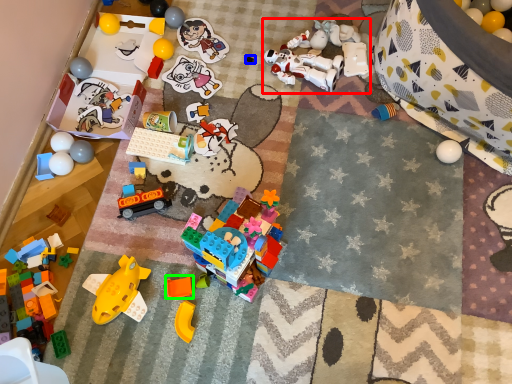
Question: Which object is positioned closest to toy (highlighted by a red box)? Select from toy (highlighted by a blue box) and toy (highlighted by a green box).

Choices:
 (A) toy
 (B) toy

Answer: (A)